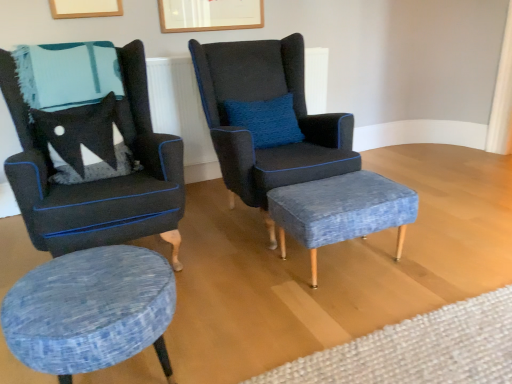
The width and height of the screenshot is (512, 384). I want to click on vacant space to the right of blue fabric stool at center, which appears as the 1th stool when viewed from the right, so click(433, 260).